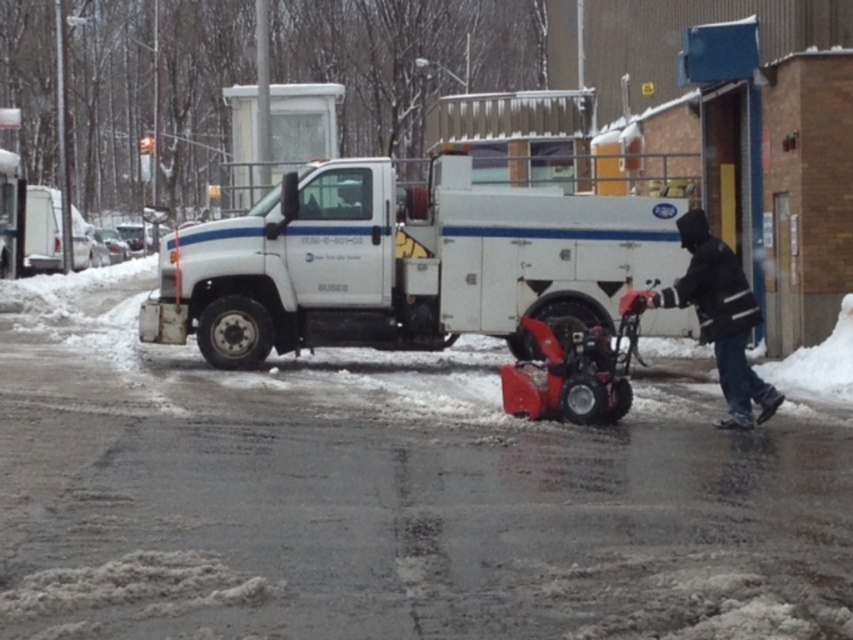
In the scene shown: Does white matte truck at center have a smaller size compared to black matte jacket at center?

Yes, white matte truck at center is smaller than black matte jacket at center.

Does white matte truck at center appear over black matte jacket at center?

Yes.

Which is behind, point (592, 260) or point (727, 384)?

Point (592, 260)

Locate an element on the screen. This screenshot has width=853, height=640. white matte truck at center is located at coordinates [x=402, y=262].